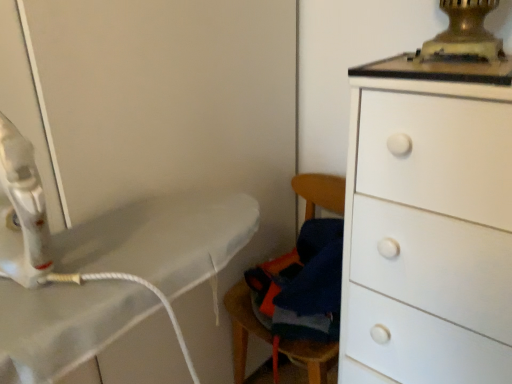
Question: Is white matte chest of drawers at right bigger than wooden swivel chair at lower center?

Choices:
 (A) yes
 (B) no

Answer: (A)

Question: Could you tell me if white matte chest of drawers at right is facing wooden swivel chair at lower center?

Choices:
 (A) no
 (B) yes

Answer: (A)

Question: Can you confirm if white matte chest of drawers at right is positioned to the right of wooden swivel chair at lower center?

Choices:
 (A) no
 (B) yes

Answer: (B)

Question: Is white matte chest of drawers at right at the left side of wooden swivel chair at lower center?

Choices:
 (A) no
 (B) yes

Answer: (A)

Question: Is white matte chest of drawers at right positioned far away from wooden swivel chair at lower center?

Choices:
 (A) no
 (B) yes

Answer: (A)

Question: Is white matte chest of drawers at right positioned behind wooden swivel chair at lower center?

Choices:
 (A) yes
 (B) no

Answer: (B)

Question: Is wooden swivel chair at lower center positioned far away from white matte chest of drawers at right?

Choices:
 (A) yes
 (B) no

Answer: (B)

Question: Does wooden swivel chair at lower center have a lesser height compared to white matte chest of drawers at right?

Choices:
 (A) no
 (B) yes

Answer: (B)

Question: Considering the relative positions of wooden swivel chair at lower center and white matte chest of drawers at right in the image provided, is wooden swivel chair at lower center to the right of white matte chest of drawers at right from the viewer's perspective?

Choices:
 (A) no
 (B) yes

Answer: (A)

Question: From the image's perspective, would you say wooden swivel chair at lower center is positioned over white matte chest of drawers at right?

Choices:
 (A) yes
 (B) no

Answer: (A)

Question: Is wooden swivel chair at lower center bigger than white matte chest of drawers at right?

Choices:
 (A) yes
 (B) no

Answer: (B)

Question: Is wooden swivel chair at lower center oriented away from white matte chest of drawers at right?

Choices:
 (A) no
 (B) yes

Answer: (A)

Question: Visually, is wooden swivel chair at lower center positioned to the left or to the right of white matte chest of drawers at right?

Choices:
 (A) right
 (B) left

Answer: (B)